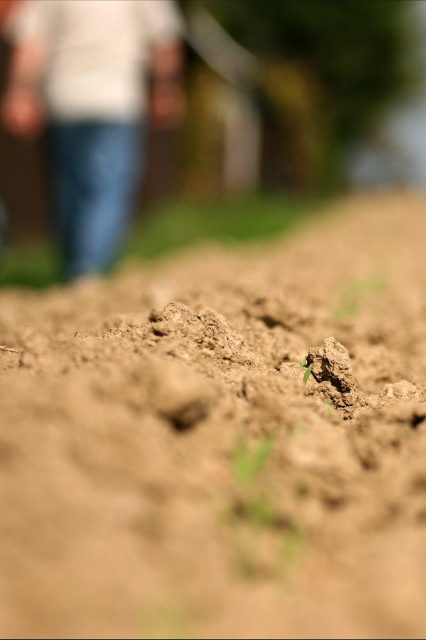
You are a gardener who wants to plant a new row of seeds. You have a bag of seeds that requires a planting area larger than the denim jeans at left. Can the brown soil at center accommodate the seeds?

The brown soil at center is smaller than the denim jeans at left, so it cannot accommodate the seeds since the required area must be larger than the denim jeans at left.

You are a gardener standing at the point marked by coordinates point (x=221, y=440). Looking around, you see brown soil at center. What is the color of the soil directly under your feet?

The point (x=221, y=440) marks brown soil at center, so the soil directly under your feet is brown.